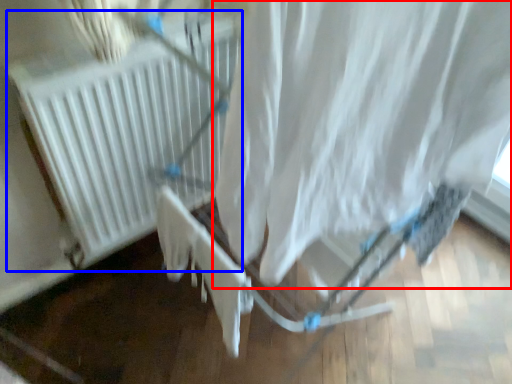
Question: Which object appears farthest to the camera in this image, curtain (highlighted by a red box) or heater (highlighted by a blue box)?

Choices:
 (A) curtain
 (B) heater

Answer: (B)